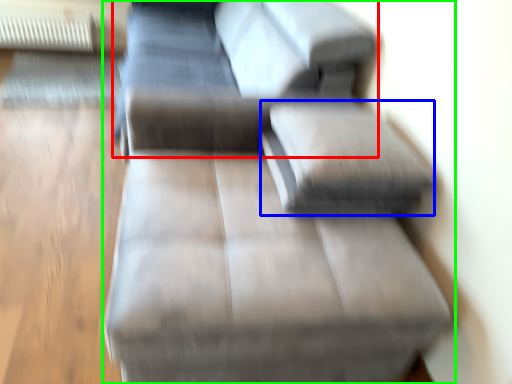
Question: Considering the real-world distances, which object is closest to couch (highlighted by a red box)? pillow (highlighted by a blue box) or studio couch (highlighted by a green box).

Choices:
 (A) pillow
 (B) studio couch

Answer: (B)